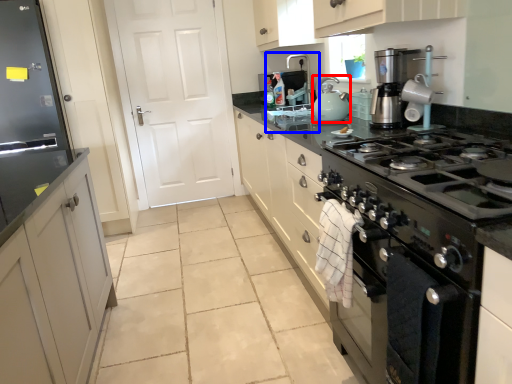
Question: Among these objects, which one is farthest to the camera, kitchen appliance (highlighted by a red box) or sink (highlighted by a blue box)?

Choices:
 (A) kitchen appliance
 (B) sink

Answer: (B)